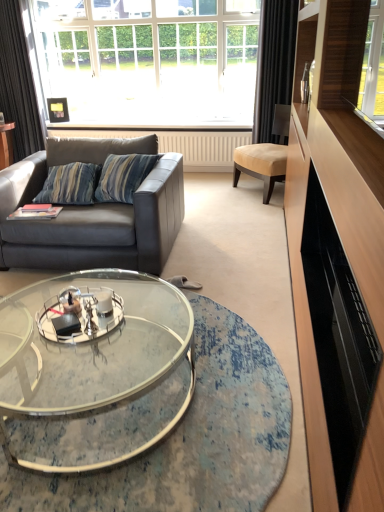
At what (x,y) coordinates should I click in order to perform the action: click on black glossy entertainment center at right. Please return your answer as a coordinate pair (x, y). Looking at the image, I should click on (337, 261).

This screenshot has height=512, width=384. What do you see at coordinates (150, 60) in the screenshot? I see `white glass window at upper center` at bounding box center [150, 60].

Image resolution: width=384 pixels, height=512 pixels. What do you see at coordinates (204, 148) in the screenshot? I see `white textured radiator at center` at bounding box center [204, 148].

Describe the element at coordinates (18, 83) in the screenshot. I see `dark gray fabric curtain at left, which ranks as the 2th curtain in right-to-left order` at that location.

The width and height of the screenshot is (384, 512). What are the coordinates of `black glossy entertainment center at right` in the screenshot? It's located at (337, 261).

Which curtain is the 1st one when counting from the back of the beige fabric chair at center? Please provide its 2D coordinates.

[(274, 64)]

Is black fabric curtain at right, placed as the second curtain when sorted from left to right, oriented towards beige fabric chair at center?

Yes, black fabric curtain at right, placed as the second curtain when sorted from left to right, is turned towards beige fabric chair at center.

Considering the sizes of objects black fabric curtain at right, placed as the second curtain when sorted from left to right, and beige fabric chair at center in the image provided, who is smaller, black fabric curtain at right, placed as the second curtain when sorted from left to right, or beige fabric chair at center?

black fabric curtain at right, placed as the second curtain when sorted from left to right, is smaller.

Looking at this image, how much distance is there between black fabric curtain at right, the first curtain viewed from the right, and beige fabric chair at center?

They are 48.32 centimeters apart.

Is black glossy entertainment center at right completely or partially outside of beige fabric chair at center?

Yes, black glossy entertainment center at right is not within beige fabric chair at center.

Consider the image. Which is closer, (329, 361) or (278, 150)?

Point (329, 361) appears to be closer to the viewer than point (278, 150).

Considering the sizes of objects black glossy entertainment center at right and beige fabric chair at center in the image provided, who is taller, black glossy entertainment center at right or beige fabric chair at center?

With more height is beige fabric chair at center.

From a real-world perspective, which object rests below the other?

From a 3D spatial view, beige fabric chair at center is below.

From the image's perspective, between leather couch at left and dark gray fabric curtain at left, which ranks as the 2th curtain in right-to-left order, which one is located above?

dark gray fabric curtain at left, which ranks as the 2th curtain in right-to-left order.

Is leather couch at left situated inside dark gray fabric curtain at left, which ranks as the 2th curtain in right-to-left order, or outside?

The correct answer is: outside.

What's the angular difference between leather couch at left and dark gray fabric curtain at left, which ranks as the 2th curtain in right-to-left order,'s facing directions?

0.872 degrees separate the facing orientations of leather couch at left and dark gray fabric curtain at left, which ranks as the 2th curtain in right-to-left order.

Would you say leather couch at left is a long distance from dark gray fabric curtain at left, the 1th curtain in the left-to-right sequence?

Indeed, leather couch at left is not near dark gray fabric curtain at left, the 1th curtain in the left-to-right sequence.

Which of these two, beige fabric chair at center or dark gray fabric curtain at left, which ranks as the 2th curtain in right-to-left order, is thinner?

dark gray fabric curtain at left, which ranks as the 2th curtain in right-to-left order, is thinner.

Is beige fabric chair at center oriented away from dark gray fabric curtain at left, the 1th curtain in the left-to-right sequence?

beige fabric chair at center is not turned away from dark gray fabric curtain at left, the 1th curtain in the left-to-right sequence.

From the image's perspective, relative to dark gray fabric curtain at left, the 1th curtain in the left-to-right sequence, is beige fabric chair at center above or below?

beige fabric chair at center is situated lower than dark gray fabric curtain at left, the 1th curtain in the left-to-right sequence, in the image.

Is beige fabric chair at center outside of dark gray fabric curtain at left, which ranks as the 2th curtain in right-to-left order?

Yes, beige fabric chair at center is located beyond the bounds of dark gray fabric curtain at left, which ranks as the 2th curtain in right-to-left order.

Can you confirm if white glass window at upper center is shorter than beige fabric chair at center?

No.

Is white glass window at upper center oriented towards beige fabric chair at center?

Yes, white glass window at upper center is facing beige fabric chair at center.

Which is more to the right, white glass window at upper center or beige fabric chair at center?

beige fabric chair at center is more to the right.

Looking at this image, in terms of width, does white glass window at upper center look wider or thinner when compared to beige fabric chair at center?

Clearly, white glass window at upper center has less width compared to beige fabric chair at center.

Consider the image. Who is smaller, beige fabric chair at center or clear glass coffee table at center?

With smaller size is beige fabric chair at center.

Considering the sizes of objects beige fabric chair at center and clear glass coffee table at center in the image provided, who is shorter, beige fabric chair at center or clear glass coffee table at center?

clear glass coffee table at center is shorter.

From a real-world perspective, between beige fabric chair at center and clear glass coffee table at center, who is vertically lower?

In real-world perspective, clear glass coffee table at center is lower.

From the picture: Are beige fabric chair at center and clear glass coffee table at center making contact?

No, beige fabric chair at center is not making contact with clear glass coffee table at center.

Would you say black glossy entertainment center at right is a long distance from leather couch at left?

black glossy entertainment center at right is far away from leather couch at left.

Based on the photo, from a real-world perspective, is black glossy entertainment center at right over leather couch at left?

Yes, from a real-world perspective, black glossy entertainment center at right is above leather couch at left.

Is black glossy entertainment center at right at the right side of leather couch at left?

Yes.

Is leather couch at left located within black glossy entertainment center at right?

Definitely not — leather couch at left is not inside black glossy entertainment center at right.

At what (x,y) coordinates should I click in order to perform the action: click on curtain that is the 1st one when counting backward from the beige fabric chair at center. Please return your answer as a coordinate pair (x, y). Looking at the image, I should click on click(x=274, y=64).

Where is `entertainment center below the beige fabric chair at center (from the image's perspective)`? This screenshot has height=512, width=384. entertainment center below the beige fabric chair at center (from the image's perspective) is located at coordinates pyautogui.click(x=337, y=261).

Which object lies nearer to the anchor point black glossy entertainment center at right, clear glass coffee table at center or white glass window at upper center?

clear glass coffee table at center is positioned closer to the anchor black glossy entertainment center at right.

When comparing their distances from white textured radiator at center, does dark gray fabric curtain at left, which ranks as the 2th curtain in right-to-left order, or black fabric curtain at right, the first curtain viewed from the right, seem further?

Based on the image, dark gray fabric curtain at left, which ranks as the 2th curtain in right-to-left order, appears to be further to white textured radiator at center.

Estimate the real-world distances between objects in this image. Which object is further from leather couch at left, beige fabric chair at center or white textured radiator at center?

white textured radiator at center.

From the image, which object appears to be farther from beige fabric chair at center, dark gray fabric curtain at left, the 1th curtain in the left-to-right sequence, or white textured radiator at center?

dark gray fabric curtain at left, the 1th curtain in the left-to-right sequence, is positioned further to the anchor beige fabric chair at center.

When comparing their distances from white glass window at upper center, does black glossy entertainment center at right or white textured radiator at center seem further?

The object further to white glass window at upper center is black glossy entertainment center at right.

Which object lies further to the anchor point beige fabric chair at center, black glossy entertainment center at right or leather couch at left?

Based on the image, leather couch at left appears to be further to beige fabric chair at center.

Considering their positions, is dark gray fabric curtain at left, the 1th curtain in the left-to-right sequence, positioned further to white glass window at upper center than black fabric curtain at right, placed as the second curtain when sorted from left to right?

black fabric curtain at right, placed as the second curtain when sorted from left to right.

Which object lies further to the anchor point white textured radiator at center, clear glass coffee table at center or white glass window at upper center?

clear glass coffee table at center lies further to white textured radiator at center than the other object.

Locate an element on the screen. Image resolution: width=384 pixels, height=512 pixels. radiator between dark gray fabric curtain at left, which ranks as the 2th curtain in right-to-left order, and black fabric curtain at right, the first curtain viewed from the right, in the horizontal direction is located at coordinates (204, 148).

This screenshot has height=512, width=384. In order to click on studio couch between dark gray fabric curtain at left, the 1th curtain in the left-to-right sequence, and beige fabric chair at center, in the horizontal direction in this screenshot , I will do `click(93, 212)`.

Locate an element on the screen. This screenshot has height=512, width=384. curtain between black glossy entertainment center at right and dark gray fabric curtain at left, which ranks as the 2th curtain in right-to-left order, along the z-axis is located at coordinates (274, 64).

What are the coordinates of `curtain between clear glass coffee table at center and dark gray fabric curtain at left, which ranks as the 2th curtain in right-to-left order, from front to back` in the screenshot? It's located at pos(274,64).